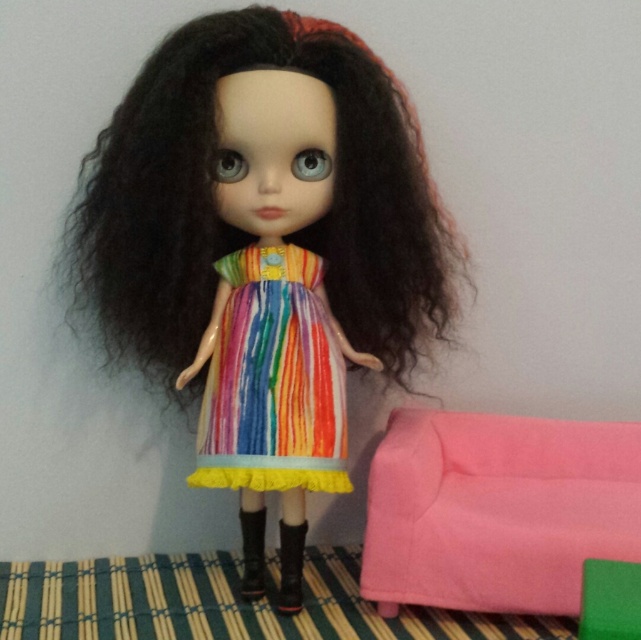
Between point (196, 344) and point (583, 577), which one is positioned behind?

Point (196, 344)

Describe the element at coordinates (265, 241) in the screenshot. I see `matte plastic doll at center` at that location.

Does point (444, 253) lie behind point (628, 637)?

Yes.

Image resolution: width=641 pixels, height=640 pixels. I want to click on matte plastic doll at center, so click(265, 241).

Does pink fabric couch at lower right have a greater width compared to green plastic stool at lower right?

Correct, the width of pink fabric couch at lower right exceeds that of green plastic stool at lower right.

Can you confirm if pink fabric couch at lower right is taller than green plastic stool at lower right?

Yes, pink fabric couch at lower right is taller than green plastic stool at lower right.

Who is more forward, (594, 516) or (594, 568)?

Point (594, 568) is in front.

The image size is (641, 640). Identify the location of pink fabric couch at lower right. (495, 509).

Which is more to the left, pink fabric couch at lower right or leather boot at center?

leather boot at center

Is pink fabric couch at lower right taller than leather boot at center?

Indeed, pink fabric couch at lower right has a greater height compared to leather boot at center.

Which is behind, point (615, 544) or point (296, 538)?

The point (296, 538) is behind.

Find the location of a particular element. This screenshot has height=640, width=641. pink fabric couch at lower right is located at coordinates (495, 509).